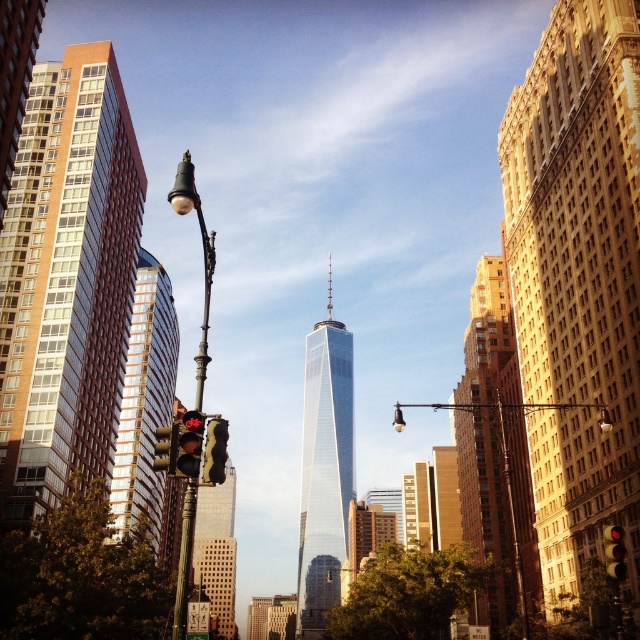
Question: Estimate the real-world distances between objects in this image. Which object is farther from the matte black traffic light at center?

Choices:
 (A) gold brick building at center
 (B) gold textured building at right
 (C) matte black streetlight at left

Answer: (A)

Question: Based on their relative distances, which object is farther from the brown glassy building at left?

Choices:
 (A) black glass traffic light at left
 (B) gold textured building at right

Answer: (B)

Question: Is brown glassy building at left to the left of black glass traffic light at left from the viewer's perspective?

Choices:
 (A) yes
 (B) no

Answer: (A)

Question: Is gold textured building at right bigger than black glass traffic light at left?

Choices:
 (A) yes
 (B) no

Answer: (A)

Question: Does gold textured building at right appear on the left side of glassy reflective skyscraper at left?

Choices:
 (A) no
 (B) yes

Answer: (A)

Question: Which object is the closest to the yellow matte traffic light at center?

Choices:
 (A) matte black traffic light at center
 (B) gold textured building at right
 (C) gold brick building at center
 (D) black glass traffic light at left

Answer: (B)